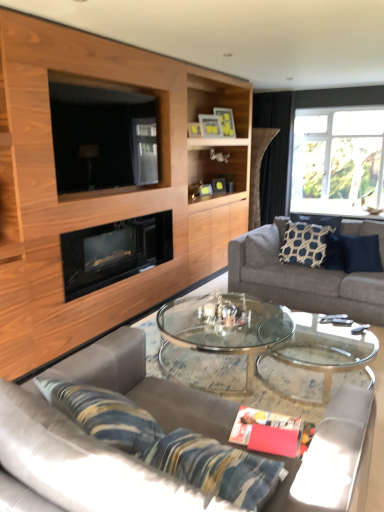
Question: Is clear glass window at upper right shorter than matte yellow picture frame at upper center, arranged as the 3th picture frame when viewed from the front?

Choices:
 (A) no
 (B) yes

Answer: (A)

Question: Is clear glass window at upper right placed right next to matte yellow picture frame at upper center, arranged as the 3th picture frame when viewed from the front?

Choices:
 (A) yes
 (B) no

Answer: (B)

Question: From a real-world perspective, is clear glass window at upper right below matte yellow picture frame at upper center, arranged as the 3th picture frame when viewed from the front?

Choices:
 (A) no
 (B) yes

Answer: (B)

Question: Is the position of clear glass window at upper right less distant than that of matte yellow picture frame at upper center, marked as the first picture frame in a back-to-front arrangement?

Choices:
 (A) yes
 (B) no

Answer: (B)

Question: Is matte yellow picture frame at upper center, marked as the first picture frame in a back-to-front arrangement, surrounded by clear glass window at upper right?

Choices:
 (A) no
 (B) yes

Answer: (A)

Question: Is clear glass window at upper right facing away from matte yellow picture frame at upper center, marked as the first picture frame in a back-to-front arrangement?

Choices:
 (A) no
 (B) yes

Answer: (A)

Question: Does wooden picture frame at upper center, which ranks as the 2th picture frame in front-to-back order, appear on the left side of black fabric curtain at upper right?

Choices:
 (A) no
 (B) yes

Answer: (B)

Question: Does wooden picture frame at upper center, which is the 2th picture frame in back-to-front order, lie behind black fabric curtain at upper right?

Choices:
 (A) yes
 (B) no

Answer: (B)

Question: Is wooden picture frame at upper center, which is the 2th picture frame in back-to-front order, next to black fabric curtain at upper right and touching it?

Choices:
 (A) yes
 (B) no

Answer: (B)

Question: Can you confirm if wooden picture frame at upper center, which is the 2th picture frame in back-to-front order, is shorter than black fabric curtain at upper right?

Choices:
 (A) yes
 (B) no

Answer: (A)

Question: Is wooden picture frame at upper center, which ranks as the 2th picture frame in front-to-back order, oriented towards black fabric curtain at upper right?

Choices:
 (A) no
 (B) yes

Answer: (A)

Question: Does wooden picture frame at upper center, which is the 2th picture frame in back-to-front order, have a lesser width compared to black fabric curtain at upper right?

Choices:
 (A) yes
 (B) no

Answer: (A)

Question: Would you say matte yellow picture frame at upper center, arranged as the 3th picture frame when viewed from the front, is a long distance from gray fabric couch at right, arranged as the first studio couch when viewed from the right?

Choices:
 (A) yes
 (B) no

Answer: (A)